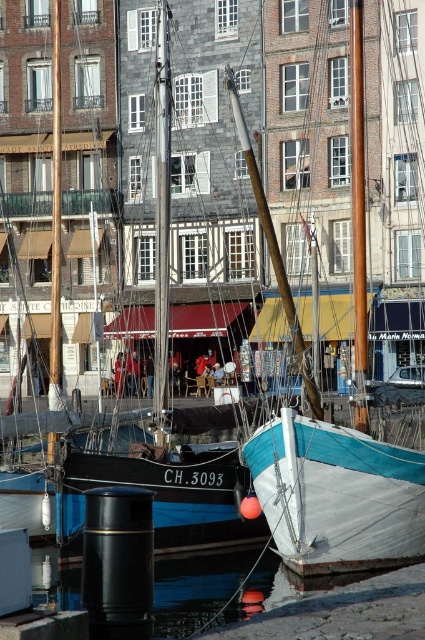
Question: Does teal canvas sailboat at center have a lesser width compared to brown polished wood mast at center?

Choices:
 (A) yes
 (B) no

Answer: (B)

Question: Observing the image, what is the correct spatial positioning of teal canvas sailboat at center in reference to brown polished wood mast at center?

Choices:
 (A) left
 (B) right

Answer: (A)

Question: Which point is farther from the camera taking this photo?

Choices:
 (A) (365, 356)
 (B) (350, 435)

Answer: (A)

Question: Which point is closer to the camera?

Choices:
 (A) (365, 237)
 (B) (299, 564)

Answer: (B)

Question: Does teal canvas sailboat at center have a lesser width compared to brown polished wood mast at center?

Choices:
 (A) no
 (B) yes

Answer: (A)

Question: Among these points, which one is nearest to the camera?

Choices:
 (A) (402, 460)
 (B) (351, 88)

Answer: (A)